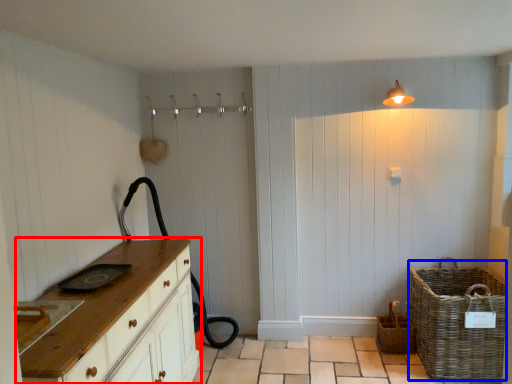
Question: Which point is closer to the camera, chest of drawers (highlighted by a red box) or basket (highlighted by a blue box)?

Choices:
 (A) chest of drawers
 (B) basket

Answer: (A)